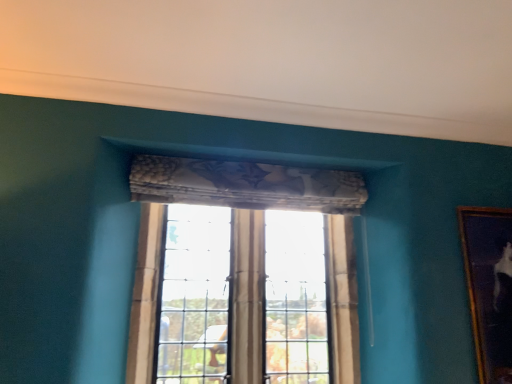
Question: Is clear glass window at center surrounding gold-framed painting at right?

Choices:
 (A) yes
 (B) no

Answer: (B)

Question: From the image's perspective, is clear glass window at center under gold-framed painting at right?

Choices:
 (A) yes
 (B) no

Answer: (A)

Question: Is the position of clear glass window at center more distant than that of gold-framed painting at right?

Choices:
 (A) yes
 (B) no

Answer: (B)

Question: Is clear glass window at center facing away from gold-framed painting at right?

Choices:
 (A) no
 (B) yes

Answer: (A)

Question: Considering the relative sizes of clear glass window at center and gold-framed painting at right in the image provided, is clear glass window at center wider than gold-framed painting at right?

Choices:
 (A) no
 (B) yes

Answer: (B)

Question: From a real-world perspective, is clear glass window at center physically below gold-framed painting at right?

Choices:
 (A) yes
 (B) no

Answer: (A)

Question: From a real-world perspective, is gold-framed painting at right positioned over clear glass window at center based on gravity?

Choices:
 (A) yes
 (B) no

Answer: (A)

Question: Are gold-framed painting at right and clear glass window at center far apart?

Choices:
 (A) yes
 (B) no

Answer: (A)

Question: Is clear glass window at center at the back of gold-framed painting at right?

Choices:
 (A) yes
 (B) no

Answer: (B)

Question: From the image's perspective, does gold-framed painting at right appear higher than clear glass window at center?

Choices:
 (A) no
 (B) yes

Answer: (B)

Question: From a real-world perspective, is gold-framed painting at right positioned under clear glass window at center based on gravity?

Choices:
 (A) no
 (B) yes

Answer: (A)

Question: Could you tell me if gold-framed painting at right is turned towards clear glass window at center?

Choices:
 (A) no
 (B) yes

Answer: (A)

Question: Considering the relative positions of gold-framed painting at right and clear glass window at center in the image provided, is gold-framed painting at right to the left or to the right of clear glass window at center?

Choices:
 (A) left
 (B) right

Answer: (B)